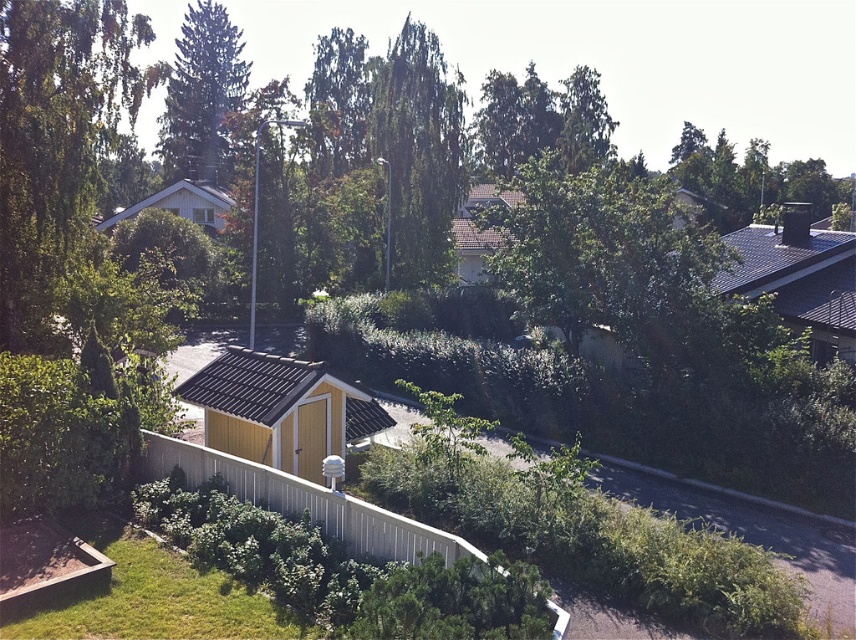
Can you confirm if green leafy tree at upper left is taller than green leafy tree at center?

Indeed, green leafy tree at upper left has a greater height compared to green leafy tree at center.

Who is positioned more to the right, green leafy tree at upper left or green leafy tree at center?

Positioned to the right is green leafy tree at center.

Who is more distant from viewer, (100, 58) or (415, 195)?

The point (415, 195) is more distant.

Image resolution: width=856 pixels, height=640 pixels. What are the coordinates of `green leafy tree at upper left` in the screenshot? It's located at (56, 141).

Is green leafy tree at upper left wider than green leafy tree at upper center?

No, green leafy tree at upper left is not wider than green leafy tree at upper center.

Between green leafy tree at upper left and green leafy tree at upper center, which one is positioned higher?

Positioned higher is green leafy tree at upper center.

Does point (10, 188) lie in front of point (159, 131)?

That is True.

The height and width of the screenshot is (640, 856). Find the location of `green leafy tree at upper left`. green leafy tree at upper left is located at coordinates (56, 141).

Is green leafy tree at center shorter than green leafy tree at upper center?

Indeed, green leafy tree at center has a lesser height compared to green leafy tree at upper center.

Which is below, green leafy tree at center or green leafy tree at upper center?

green leafy tree at center is below.

You are a GUI agent. You are given a task and a screenshot of the screen. Output one action in this format:
    pyautogui.click(x=<x>, y=<y>)
    Task: Click on the green leafy tree at center
    
    Given the screenshot: What is the action you would take?
    pyautogui.click(x=418, y=154)